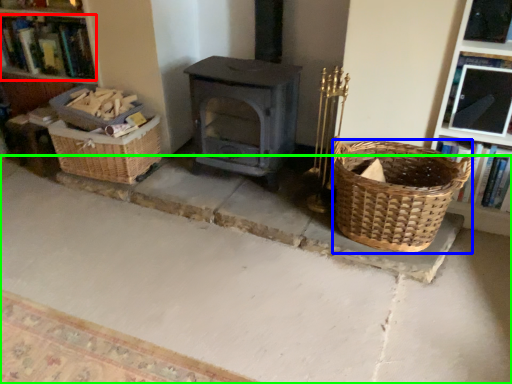
Question: Estimate the real-world distances between objects in this image. Which object is closer to book (highlighted by a red box), basket (highlighted by a blue box) or concrete (highlighted by a green box)?

Choices:
 (A) basket
 (B) concrete

Answer: (B)